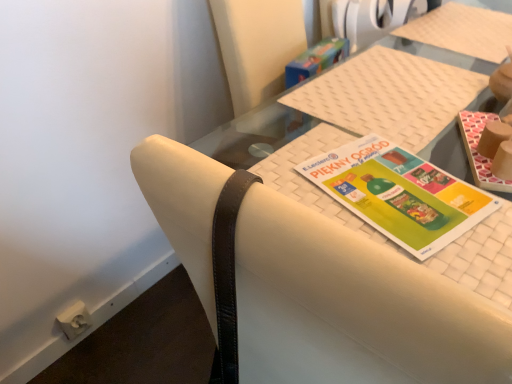
Question: Considering the positions of point (415, 256) and point (501, 185), is point (415, 256) closer or farther from the camera than point (501, 185)?

Choices:
 (A) farther
 (B) closer

Answer: (B)

Question: From a real-world perspective, relative to matte brown book at upper right, positioned as the first book in right-to-left order, is multicolored paper at center, positioned as the 1th book in left-to-right order, vertically above or below?

Choices:
 (A) below
 (B) above

Answer: (A)

Question: Which object is positioned farthest from the white woven placemat at center?

Choices:
 (A) multicolored paper at center, positioned as the 1th book in left-to-right order
 (B) matte brown book at upper right, placed as the second book when sorted from left to right
 (C) white leather chair at center

Answer: (C)

Question: Estimate the real-world distances between objects in this image. Which object is farther from the white woven placemat at center?

Choices:
 (A) multicolored paper at center, positioned as the 2th book in right-to-left order
 (B) matte brown book at upper right, positioned as the first book in right-to-left order
 (C) white leather chair at center

Answer: (C)